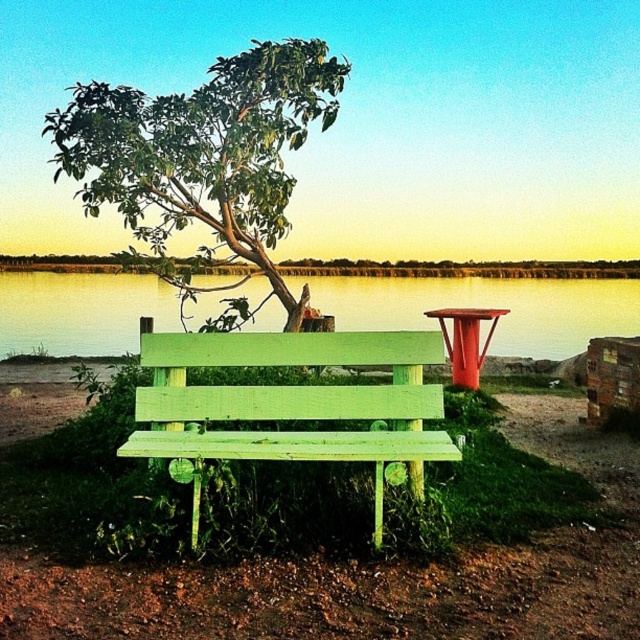
Which is behind, point (200, 154) or point (406, 292)?

The point (406, 292) is behind.

Is green leafy tree at upper center bigger than green wooden water at center?

Actually, green leafy tree at upper center might be smaller than green wooden water at center.

What do you see at coordinates (202, 154) in the screenshot?
I see `green leafy tree at upper center` at bounding box center [202, 154].

The width and height of the screenshot is (640, 640). Find the location of `green leafy tree at upper center`. green leafy tree at upper center is located at coordinates (202, 154).

Image resolution: width=640 pixels, height=640 pixels. What do you see at coordinates (202, 154) in the screenshot?
I see `green leafy tree at upper center` at bounding box center [202, 154].

Does green leafy tree at upper center have a smaller size compared to green painted wood bench at center?

Incorrect, green leafy tree at upper center is not smaller in size than green painted wood bench at center.

Locate an element on the screen. green leafy tree at upper center is located at coordinates (202, 154).

Locate an element on the screen. The width and height of the screenshot is (640, 640). green leafy tree at upper center is located at coordinates (202, 154).

Who is more forward, [381,472] or [112,301]?

Point [381,472] is in front.

Who is higher up, green painted wood bench at center or green wooden water at center?

Positioned higher is green wooden water at center.

I want to click on green painted wood bench at center, so tap(291, 404).

You are a GUI agent. You are given a task and a screenshot of the screen. Output one action in this format:
    pyautogui.click(x=<x>, y=<y>)
    Task: Click on the green painted wood bench at center
    
    Given the screenshot: What is the action you would take?
    pyautogui.click(x=291, y=404)